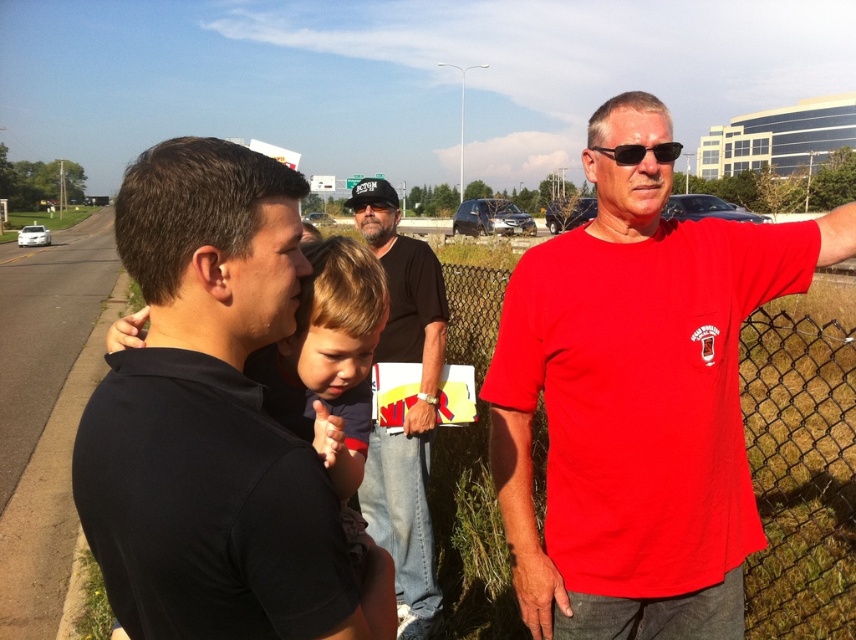
Based on the coordinates provided, which object corresponds to the point located at position (214, 420)?

The point at (214, 420) corresponds to the black matte shirt at left.

You are standing at the origin point in the image. Which of the two points, point (294, 518) or point (438, 611), is closer to you?

Point (294, 518) is closer to you because it is in front of point (438, 611).